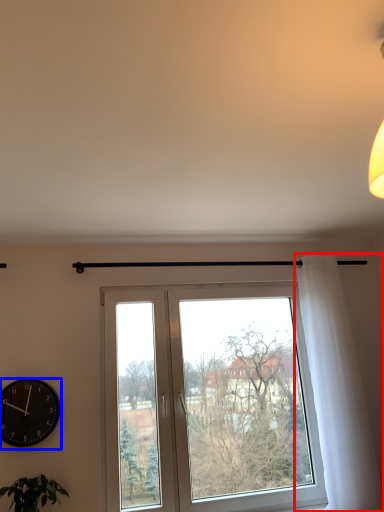
Question: Which object is closer to the camera taking this photo, curtain (highlighted by a red box) or wall clock (highlighted by a blue box)?

Choices:
 (A) curtain
 (B) wall clock

Answer: (B)